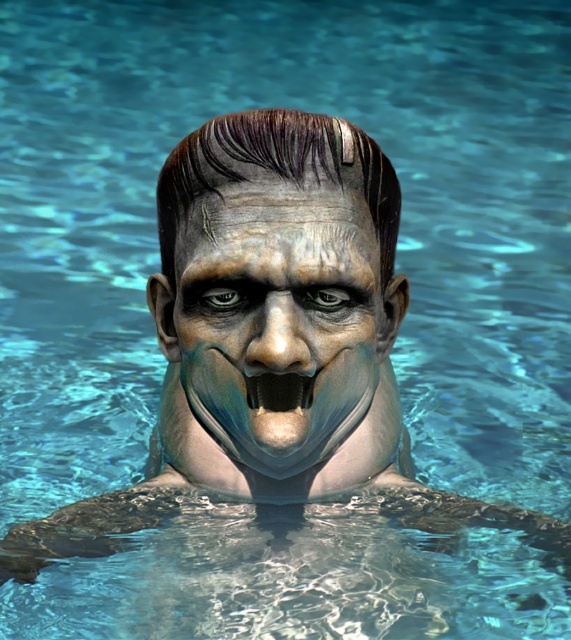
You are a lifeguard trying to locate two specific points in the pool. The first point is at coordinates point (215,396) and the second is at point (258,388). From the lifeguard stand, which point is closer to the edge of the pool?

Point (258,388) is closer to the edge of the pool because it is in front of point (215,396), which is behind it.

Based on the scene, which object is wider when viewed from the front? The pale matte face at center or the black matte teeth at center?

The pale matte face at center is wider than the black matte teeth at center.